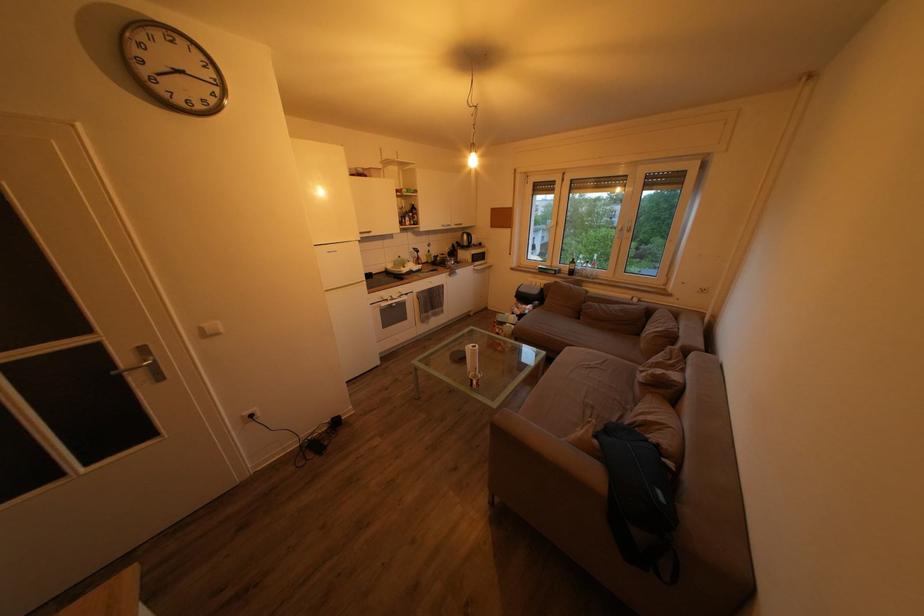
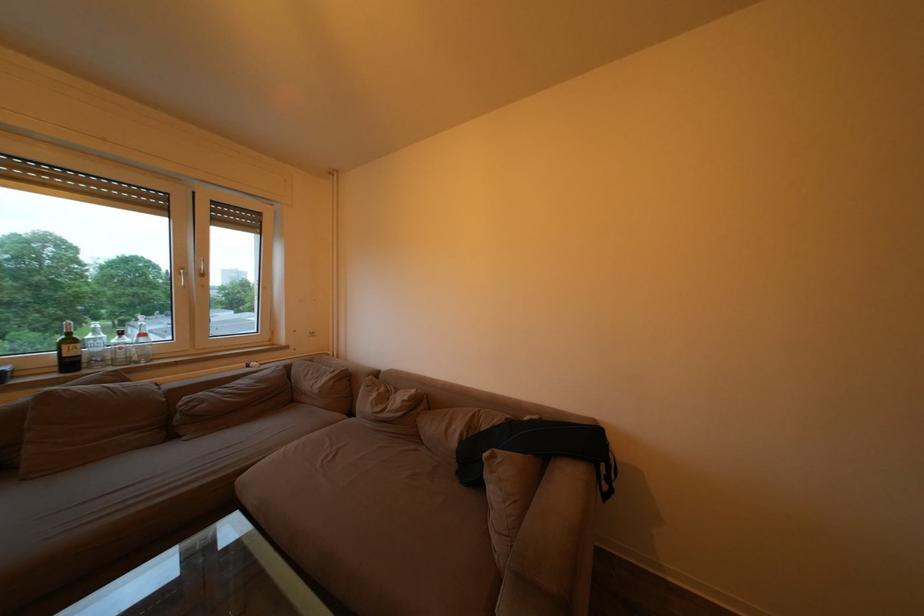
Where in the second image is the point corresponding to [586,323] from the first image?

(178, 443)